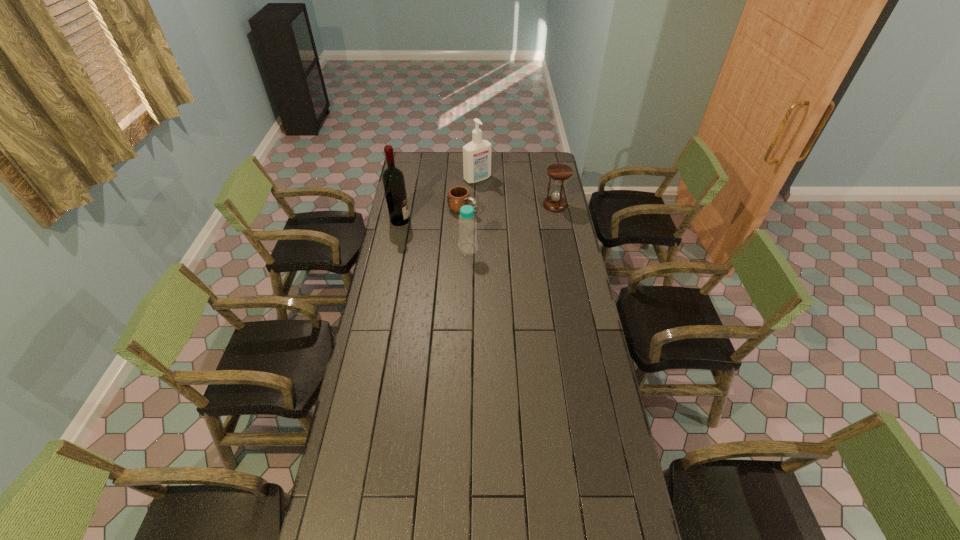
Where is `the nearest object`? the nearest object is located at coordinates (467, 224).

At what (x,y) coordinates should I click in order to perform the action: click on the rightmost object. Please return your answer as a coordinate pair (x, y). The width and height of the screenshot is (960, 540). Looking at the image, I should click on (558, 172).

Identify the location of the farthest object. The width and height of the screenshot is (960, 540). (476, 154).

At what (x,y) coordinates should I click in order to perform the action: click on cleansing agent. Please return your answer as a coordinate pair (x, y). This screenshot has height=540, width=960. Looking at the image, I should click on (476, 154).

I want to click on mug, so click(459, 196).

You are a GUI agent. You are given a task and a screenshot of the screen. Output one action in this format:
    pyautogui.click(x=<x>, y=<y>)
    Task: Click on the leftmost object
    Image resolution: width=960 pixels, height=540 pixels.
    Given the screenshot: What is the action you would take?
    pyautogui.click(x=393, y=180)

At what (x,y) coordinates should I click in order to perform the action: click on free space located on the right of the bottle. Please return your answer as a coordinate pair (x, y). The image size is (960, 540). Looking at the image, I should click on (496, 248).

Locate an element on the screen. This screenshot has height=540, width=960. vacant region located 0.230m on the back of the rightmost object is located at coordinates (549, 174).

Where is `free space located 0.120m on the front label of the second tallest object`? The width and height of the screenshot is (960, 540). free space located 0.120m on the front label of the second tallest object is located at coordinates (495, 195).

Image resolution: width=960 pixels, height=540 pixels. Identify the location of vacant point located on the front label of the second tallest object. (516, 213).